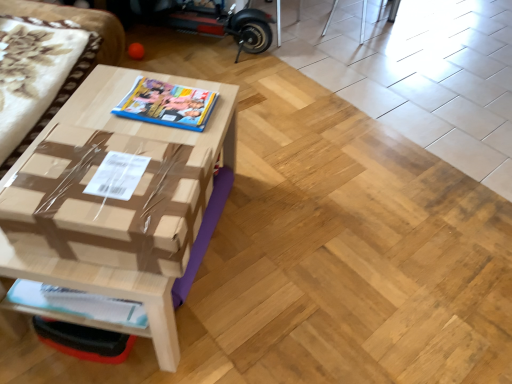
You are a GUI agent. You are given a task and a screenshot of the screen. Output one action in this format:
    pyautogui.click(x=<x>, y=<y>)
    Task: Click on the vacant area on top of brown cardboard table at center (from a real-world perspective)
    
    Given the screenshot: What is the action you would take?
    pyautogui.click(x=150, y=109)